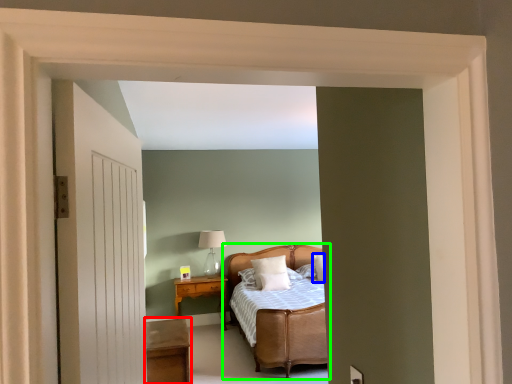
Question: Estimate the real-world distances between objects in this image. Which object is closer to table (highlighted by a red box), pillow (highlighted by a blue box) or bed (highlighted by a green box)?

Choices:
 (A) pillow
 (B) bed

Answer: (B)